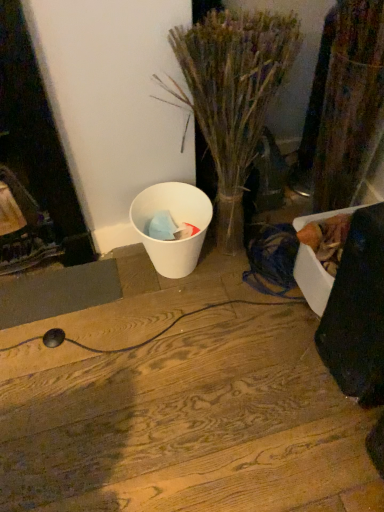
This screenshot has width=384, height=512. What are the coordinates of `blank space situated above wooden floor at center (from a real-world perspective)` in the screenshot? It's located at (117, 375).